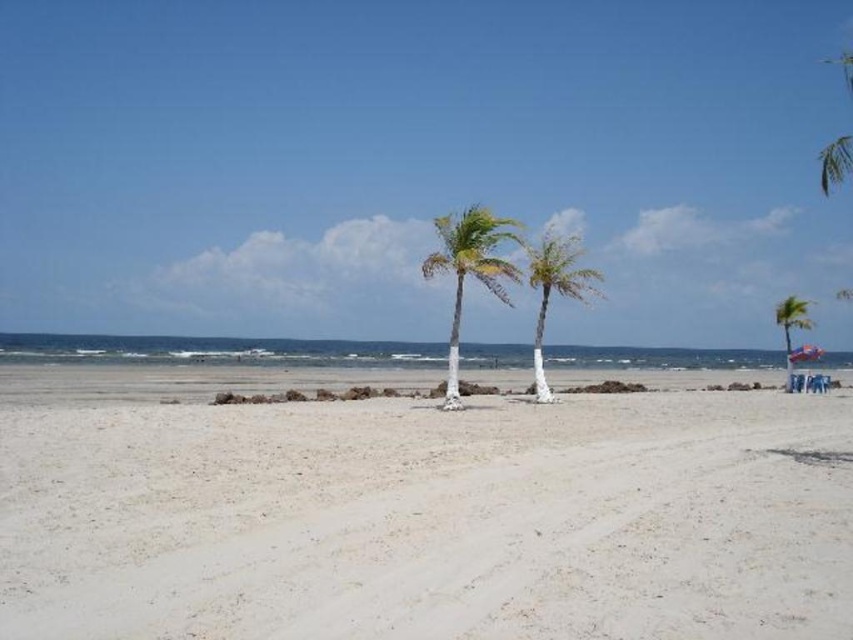
Who is more forward, (74, 538) or (561, 257)?

Point (74, 538)

Is point (132, 525) positioned in front of point (549, 392)?

Yes, point (132, 525) is closer to viewer.

Image resolution: width=853 pixels, height=640 pixels. What do you see at coordinates (430, 518) in the screenshot? I see `white sandy beach at center` at bounding box center [430, 518].

Identify the location of white sandy beach at center. (430, 518).

Can you confirm if white painted wood palm tree at center is wider than green leafy palm tree at right?

No.

I want to click on white painted wood palm tree at center, so click(x=555, y=289).

Find the location of a particular element. This screenshot has height=640, width=853. white painted wood palm tree at center is located at coordinates (555, 289).

Is green leafy palm tree at center further to camera compared to white painted wood palm tree at center?

That is False.

Based on the photo, which of these two, green leafy palm tree at center or white painted wood palm tree at center, stands taller?

white painted wood palm tree at center

Where is `green leafy palm tree at center`? This screenshot has height=640, width=853. green leafy palm tree at center is located at coordinates (469, 269).